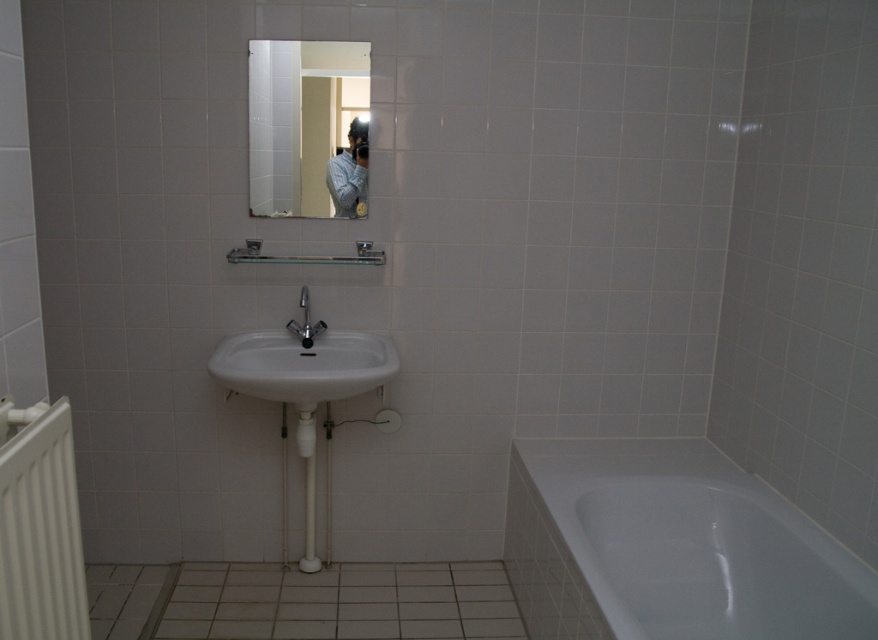
You are standing in the bathroom and want to place a new decorative item on the surface closest to you. Which object from the white glossy bathtub at lower right and blue textured shirt at upper center should you choose to place it on?

The white glossy bathtub at lower right is in front of the blue textured shirt at upper center, so the surface closest to you is the white glossy bathtub at lower right. You should place the decorative item on the white glossy bathtub at lower right.

You are standing in the bathroom and want to know which of the two points, point (728,556) or point (332,179), is closer to you. Based on the scene description, can you determine this?

Point (728,556) is closer to the viewer than point (332,179).

You are a photographer standing in the bathroom and want to capture a photo of the blue textured shirt at upper center and the matte silver faucet at center. Which object is located to the right of the other?

The blue textured shirt at upper center is positioned on the right side of matte silver faucet at center.